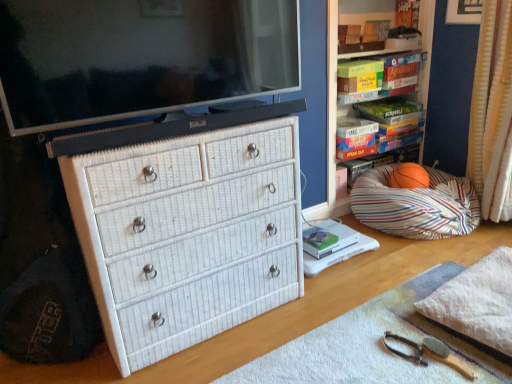
Question: In terms of size, does hardcover book at upper right, the 2th book viewed from the left, appear bigger or smaller than matte black flat-screen tv at upper center?

Choices:
 (A) big
 (B) small

Answer: (B)

Question: Is hardcover book at upper right, which is the 2th book from front to back, taller or shorter than matte black flat-screen tv at upper center?

Choices:
 (A) short
 (B) tall

Answer: (A)

Question: Considering the real-world distances, which object is farthest from the white fluffy blanket at lower right?

Choices:
 (A) hardcover book at center, the first book from the front
 (B) matte black flat-screen tv at upper center
 (C) white textured curtain at right
 (D) striped fabric bean bag at right
 (E) wooden brush at lower right

Answer: (B)

Question: Which is nearer to the matte black flat-screen tv at upper center?

Choices:
 (A) wooden brush at lower right
 (B) hardcover book at upper right, acting as the 1th book starting from the back
 (C) white wicker chest at center
 (D) striped fabric bean bag at right
 (E) white textured curtain at right

Answer: (D)